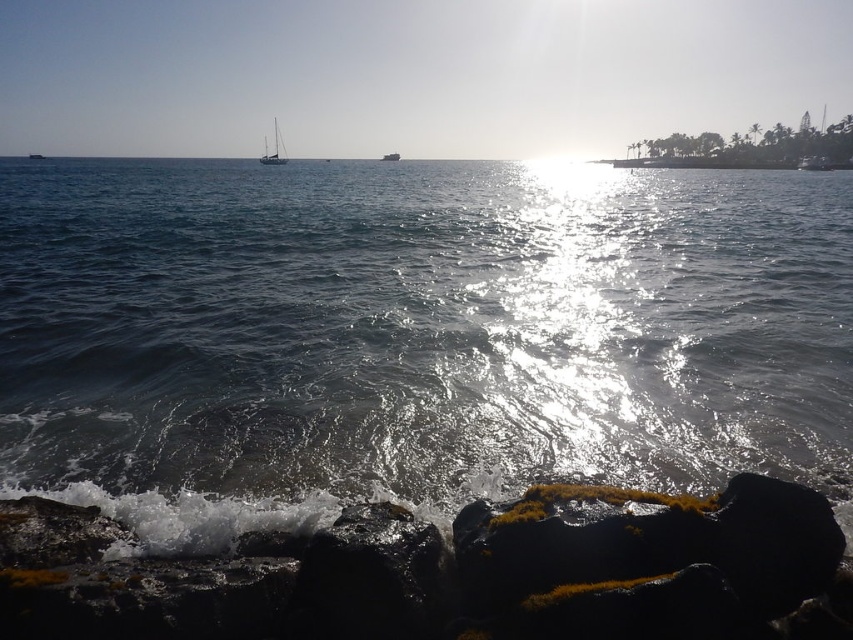
You are a photographer trying to capture the reflection of the sunset on the water. You notice the glistening water at center marked by point (413, 333). Where should you position your camera relative to this point to best capture the reflection?

To best capture the reflection of the sunset on the water at point (413, 333), position your camera directly above this point since reflections are typically mirrored along the water surface.

You are a photographer wanting to capture the glistening water at center and the smooth black rock at lower left in a single frame. Which object will occupy more of the photo composition?

The glistening water at center will occupy more of the photo composition because it is bigger than the smooth black rock at lower left.

Based on the photo, you are a photographer planning to take a photo of the glistening water at center and the metallic silver boat at center from a position on the shore. Given that your camera has a maximum focus range of 500 feet, will you be able to capture both subjects in focus without moving closer?

The glistening water at center and metallic silver boat at center are 557.68 feet apart. Since your camera can only focus up to 500 feet, you will not be able to capture both subjects in focus without moving closer.